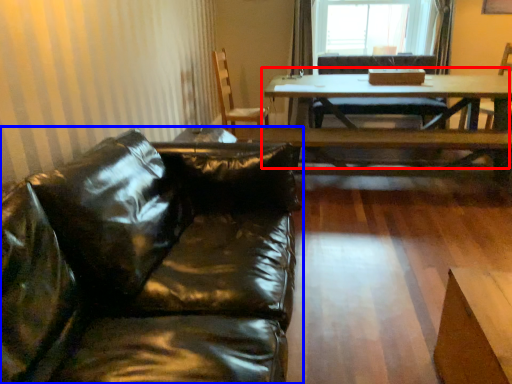
Question: Which of the following is the closest to the observer, table (highlighted by a red box) or studio couch (highlighted by a blue box)?

Choices:
 (A) table
 (B) studio couch

Answer: (B)